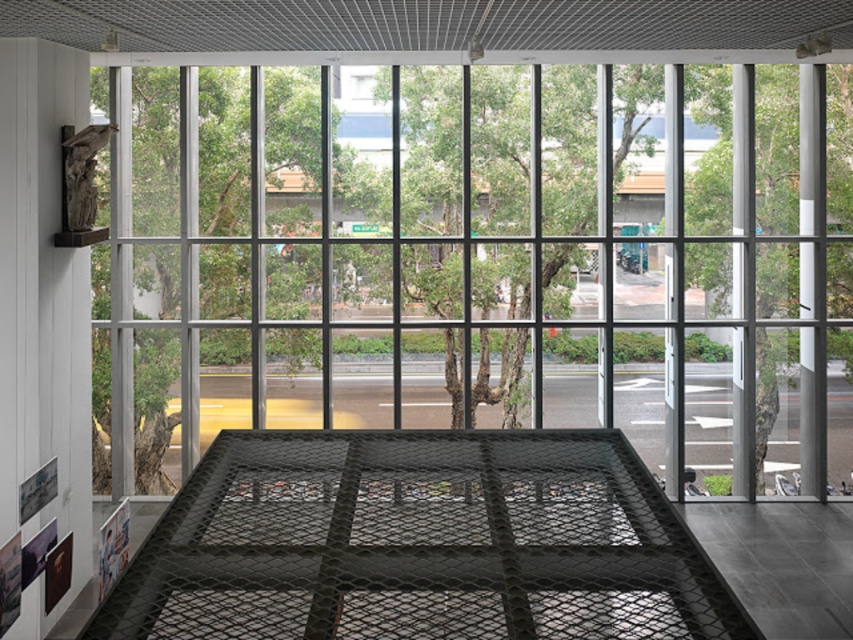
You are a delivery person with a cart that is 1.2 meters wide. You need to move from the transparent glass door at center to the white glossy pillar at right. Is there enough space between them for your cart to pass through?

The transparent glass door at center and white glossy pillar at right are 8.46 meters apart from each other. Since your cart is only 1.2 meters wide, there is more than enough space for it to pass through the 8.46 meter gap between them.

You are standing in the interior space and want to exit through the transparent glass door at center. Which direction should you walk relative to the white glossy pillar at right?

You should walk towards the left of the white glossy pillar at right because the transparent glass door at center is located to the left of it.